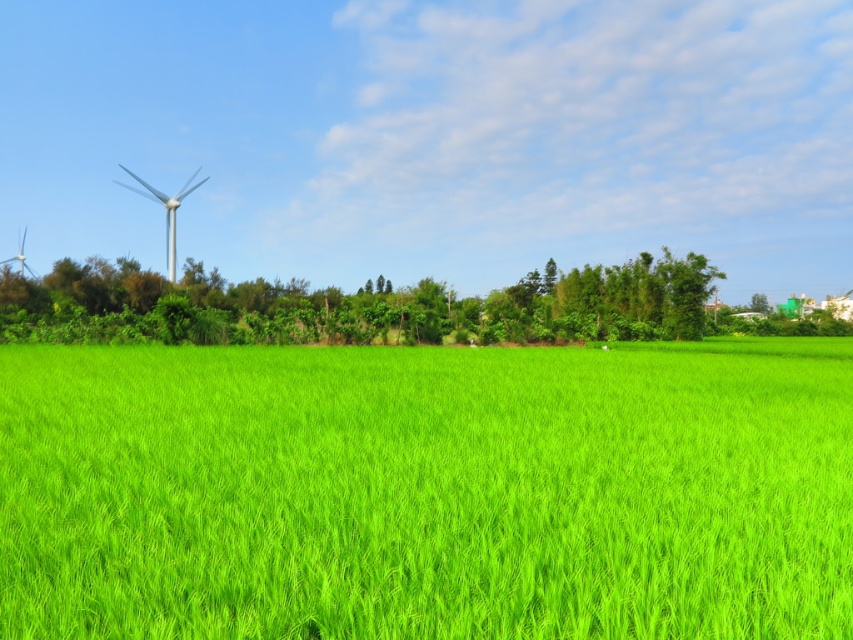
Does green grassy field at center come in front of white matte wind turbine at upper left?

Yes, it is in front of white matte wind turbine at upper left.

Which of these two, green grassy field at center or white matte wind turbine at upper left, stands taller?

white matte wind turbine at upper left

Is point (456, 445) closer to camera compared to point (160, 202)?

Yes, point (456, 445) is closer to viewer.

Identify the location of green grassy field at center. Image resolution: width=853 pixels, height=640 pixels. (427, 492).

Which is more to the left, green leafy tree at center or white matte wind turbine at upper left?

From the viewer's perspective, white matte wind turbine at upper left appears more on the left side.

Does green leafy tree at center have a greater height compared to white matte wind turbine at upper left?

Incorrect, green leafy tree at center's height is not larger of white matte wind turbine at upper left's.

Is point (135, 278) closer to viewer compared to point (151, 195)?

Yes.

Locate an element on the screen. This screenshot has width=853, height=640. green leafy tree at center is located at coordinates (357, 307).

Between green grassy field at center and green leafy tree at center, which one has less height?

green grassy field at center is shorter.

Between green grassy field at center and green leafy tree at center, which one has more height?

With more height is green leafy tree at center.

Who is more forward, (633, 454) or (341, 321)?

Positioned in front is point (633, 454).

I want to click on green grassy field at center, so click(x=427, y=492).